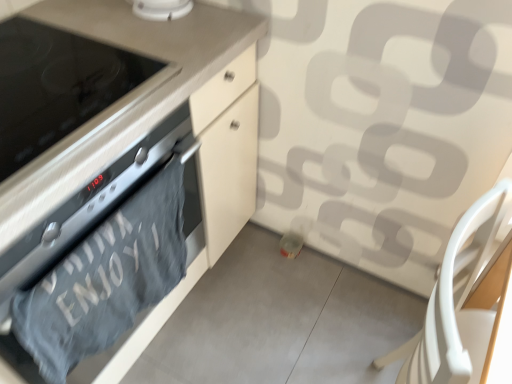
Question: From a real-world perspective, is matte black oven at left positioned under gray cotton towel at lower left based on gravity?

Choices:
 (A) no
 (B) yes

Answer: (B)

Question: From the image's perspective, is matte black oven at left located above gray cotton towel at lower left?

Choices:
 (A) yes
 (B) no

Answer: (A)

Question: Considering the relative sizes of matte black oven at left and gray cotton towel at lower left in the image provided, is matte black oven at left shorter than gray cotton towel at lower left?

Choices:
 (A) no
 (B) yes

Answer: (A)

Question: From the image's perspective, is matte black oven at left beneath gray cotton towel at lower left?

Choices:
 (A) yes
 (B) no

Answer: (B)

Question: Is matte black oven at left wider than gray cotton towel at lower left?

Choices:
 (A) yes
 (B) no

Answer: (A)

Question: In terms of width, does matte black oven at left look wider or thinner when compared to white plastic chair at lower right?

Choices:
 (A) thin
 (B) wide

Answer: (B)

Question: From a real-world perspective, is matte black oven at left above or below white plastic chair at lower right?

Choices:
 (A) above
 (B) below

Answer: (A)

Question: Relative to white plastic chair at lower right, is matte black oven at left in front or behind?

Choices:
 (A) behind
 (B) front

Answer: (A)

Question: Based on their positions, is matte black oven at left located to the left or right of white plastic chair at lower right?

Choices:
 (A) left
 (B) right

Answer: (A)

Question: Relative to black glass stove at left, is white glossy smoke detector at upper center in front or behind?

Choices:
 (A) behind
 (B) front

Answer: (A)

Question: Is white glossy smoke detector at upper center to the left or to the right of black glass stove at left in the image?

Choices:
 (A) left
 (B) right

Answer: (B)

Question: In terms of width, does white glossy smoke detector at upper center look wider or thinner when compared to black glass stove at left?

Choices:
 (A) wide
 (B) thin

Answer: (B)

Question: From the image's perspective, is white glossy smoke detector at upper center above or below black glass stove at left?

Choices:
 (A) below
 (B) above

Answer: (B)

Question: Considering the positions of black glass stove at left and gray cotton towel at lower left in the image, is black glass stove at left bigger or smaller than gray cotton towel at lower left?

Choices:
 (A) big
 (B) small

Answer: (A)

Question: Is black glass stove at left spatially inside gray cotton towel at lower left, or outside of it?

Choices:
 (A) outside
 (B) inside

Answer: (A)